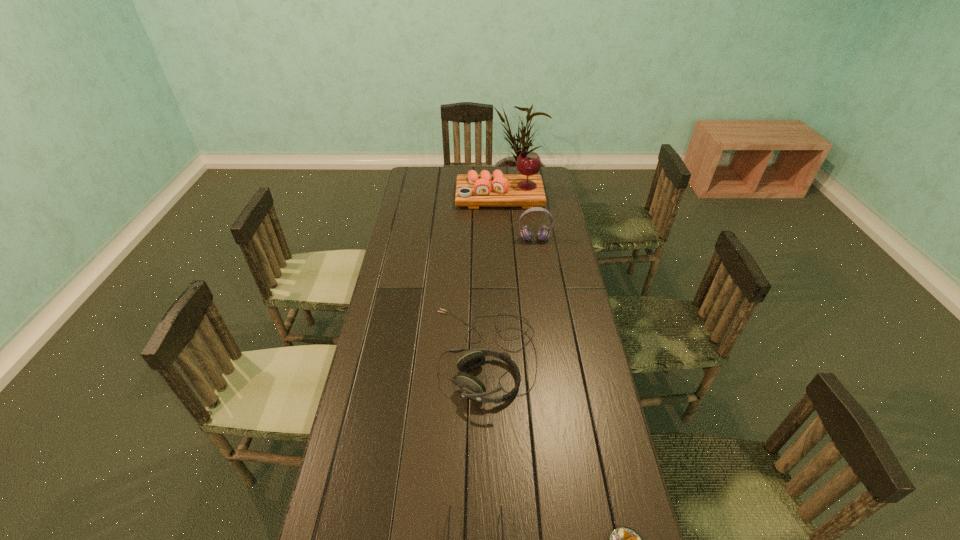
You are a GUI agent. You are given a task and a screenshot of the screen. Output one action in this format:
    pyautogui.click(x=<x>, y=<y>)
    Task: Click on the platter
    
    Given the screenshot: What is the action you would take?
    pyautogui.click(x=472, y=190)

Where is `the tallest object`? the tallest object is located at coordinates (472, 190).

The height and width of the screenshot is (540, 960). Identify the location of the farther headset. (543, 233).

This screenshot has width=960, height=540. Find the location of `the second tallest object`. the second tallest object is located at coordinates (543, 233).

I want to click on the third nearest object, so click(472, 387).

The height and width of the screenshot is (540, 960). What are the coordinates of `the third tallest object` in the screenshot? It's located at [x=472, y=387].

This screenshot has width=960, height=540. In order to click on vacant space located 0.140m on the left of the farthest object in this screenshot , I will do `click(428, 196)`.

Find the location of a particular element. This screenshot has width=960, height=540. vacant region located on the headband and ear cups of the fourth shortest object is located at coordinates (541, 285).

Where is `free region located 0.070m on the outer surface of the shorter headset`? The height and width of the screenshot is (540, 960). free region located 0.070m on the outer surface of the shorter headset is located at coordinates (412, 355).

Locate an element on the screen. vacant space situated on the outer surface of the shorter headset is located at coordinates (419, 355).